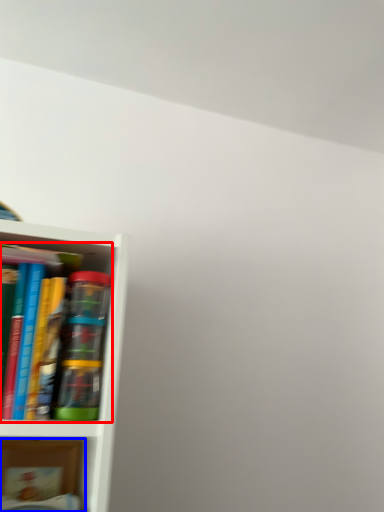
Question: Which point is closer to the camera, book (highlighted by a red box) or book (highlighted by a blue box)?

Choices:
 (A) book
 (B) book

Answer: (A)